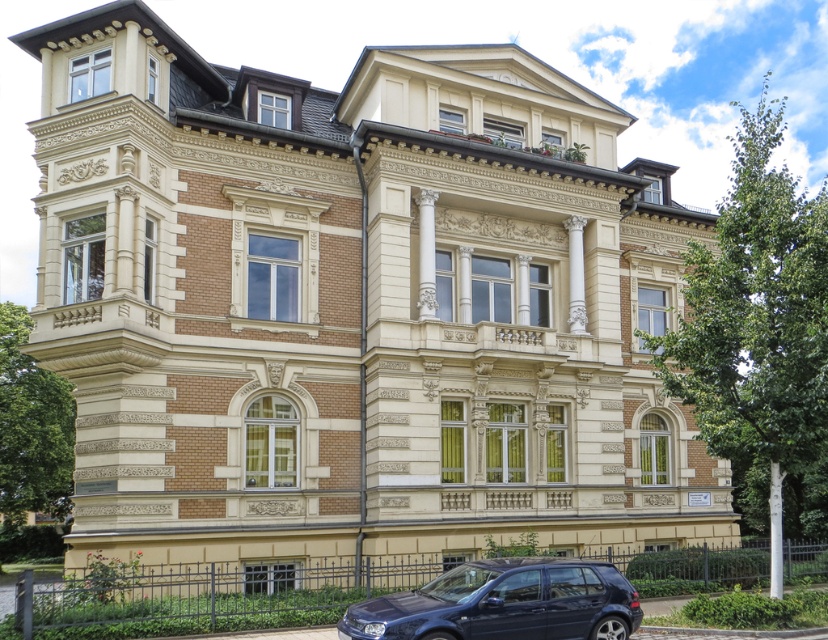
You are standing in front of a grand Victorian building and want to place a small garden ornament exactly where the green grass at lower center is located. What are the coordinates of that location?

The coordinates for the green grass at lower center are point (205, 596).